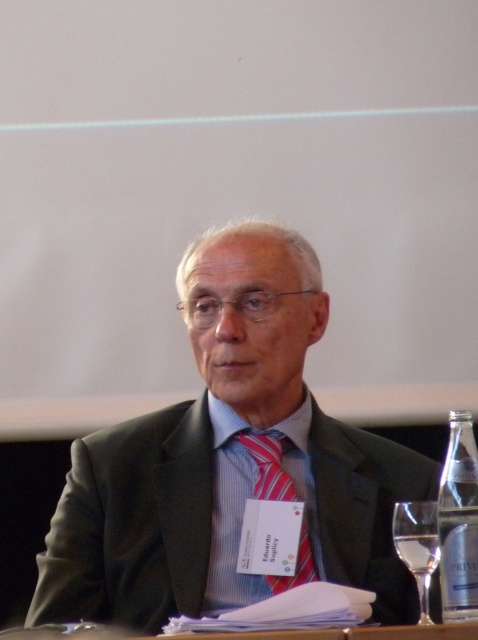
What is the color of the material at the point with coordinates (230, 461)?

The point at coordinates (230, 461) is on the matte black suit at center.

You are a photographer at a formal event. You need to ensure that the matte black suit at center is visible above the clear glass bottle at lower right in your photo. Based on their heights, will this arrangement naturally occur?

The matte black suit at center is taller than the clear glass bottle at lower right, so yes, the arrangement will naturally allow the matte black suit at center to be visible above the clear glass bottle at lower right.

What are the coordinates of the striped silk tie at center?

The striped silk tie at center is located at coordinates point [268,465].